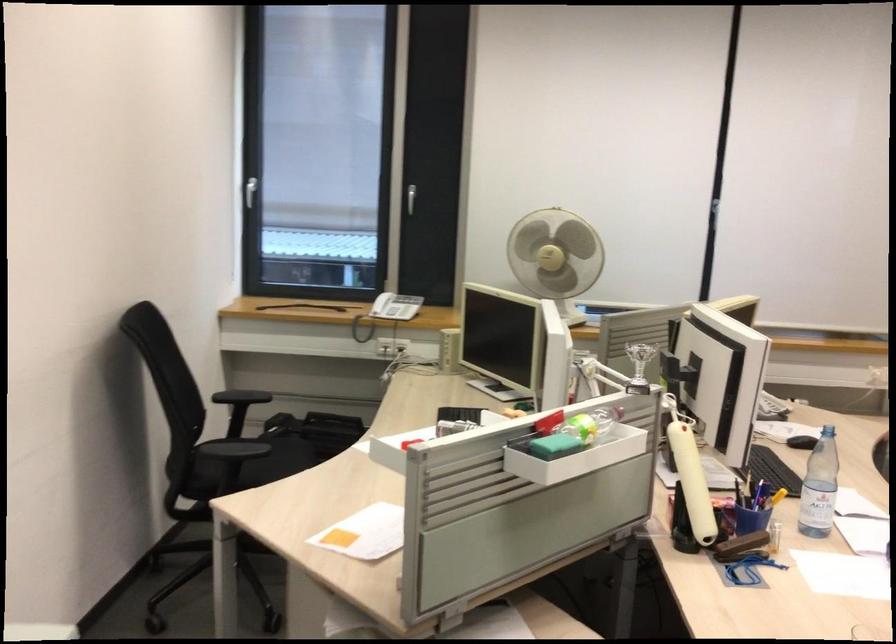
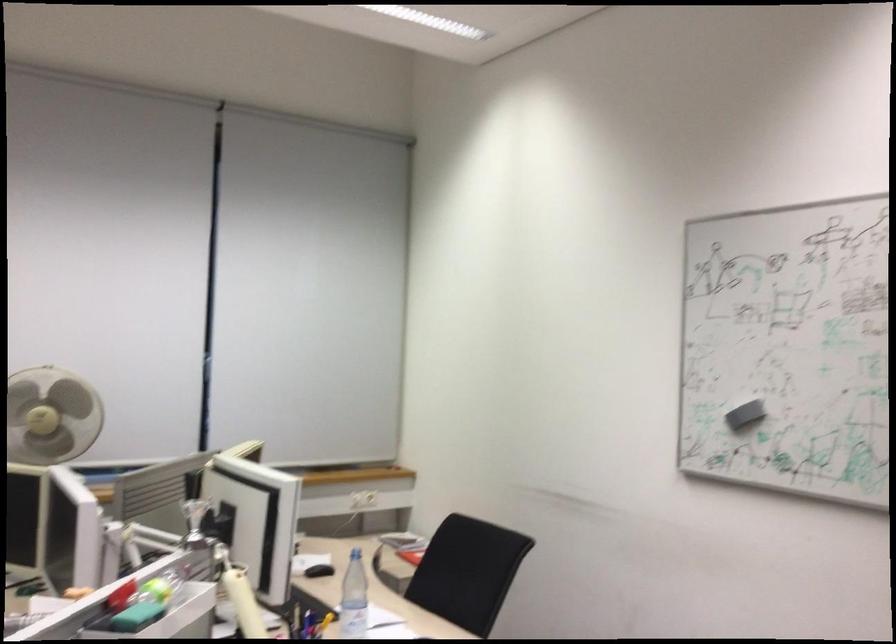
Question: The first image is from the beginning of the video and the second image is from the end. How did the camera likely rotate when shooting the video?

Choices:
 (A) Left
 (B) Right
 (C) Up
 (D) Down

Answer: (B)